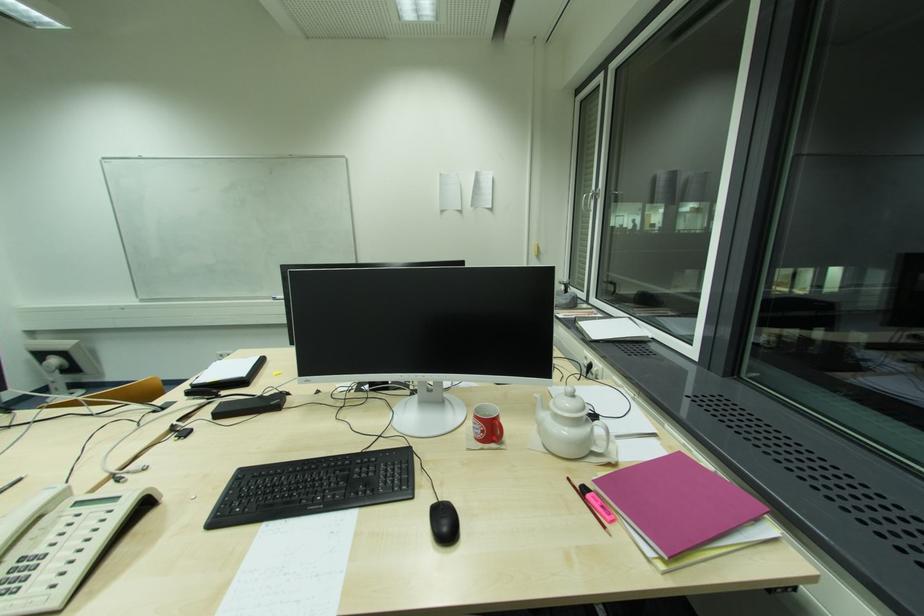
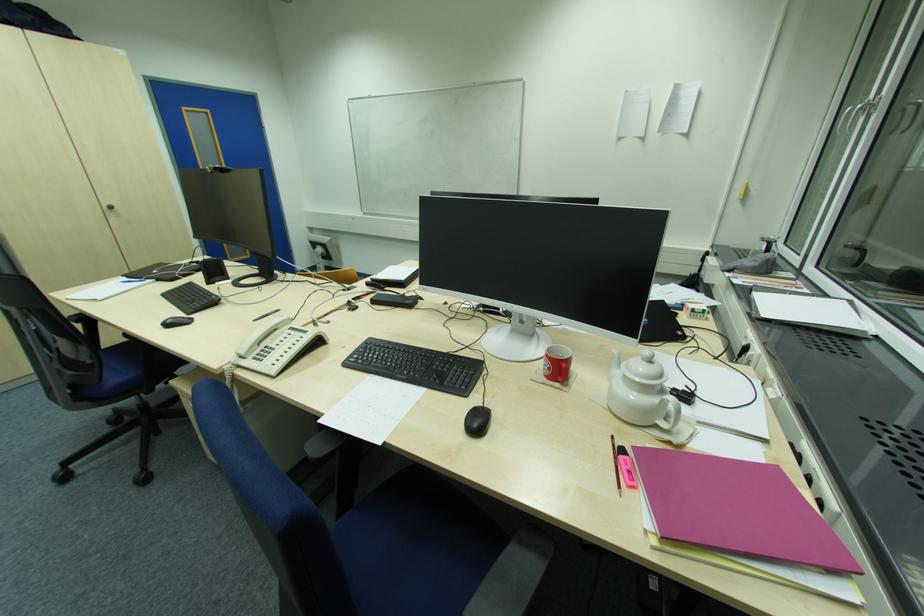
Where in the second image is the point corresponding to the point at 447,531 from the first image?

(478, 426)